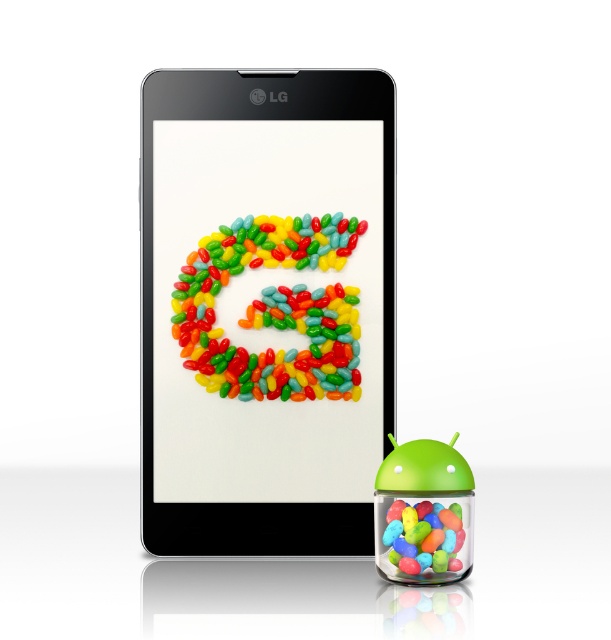
Question: Based on their relative distances, which object is nearer to the glossy jellybeans at center?

Choices:
 (A) matte plastic phone at center
 (B) glossy plastic jelly beans at lower right

Answer: (A)

Question: Which of the following is the farthest from the observer?

Choices:
 (A) glossy jellybeans at center
 (B) matte plastic phone at center

Answer: (A)

Question: Which point is farther to the camera?

Choices:
 (A) (229, 83)
 (B) (332, 388)

Answer: (A)

Question: Is glossy jellybeans at center closer to camera compared to glossy plastic jelly beans at lower right?

Choices:
 (A) yes
 (B) no

Answer: (B)

Question: Can you confirm if glossy jellybeans at center is thinner than glossy plastic jelly beans at lower right?

Choices:
 (A) no
 (B) yes

Answer: (A)

Question: Does matte plastic phone at center appear on the left side of glossy jellybeans at center?

Choices:
 (A) yes
 (B) no

Answer: (A)